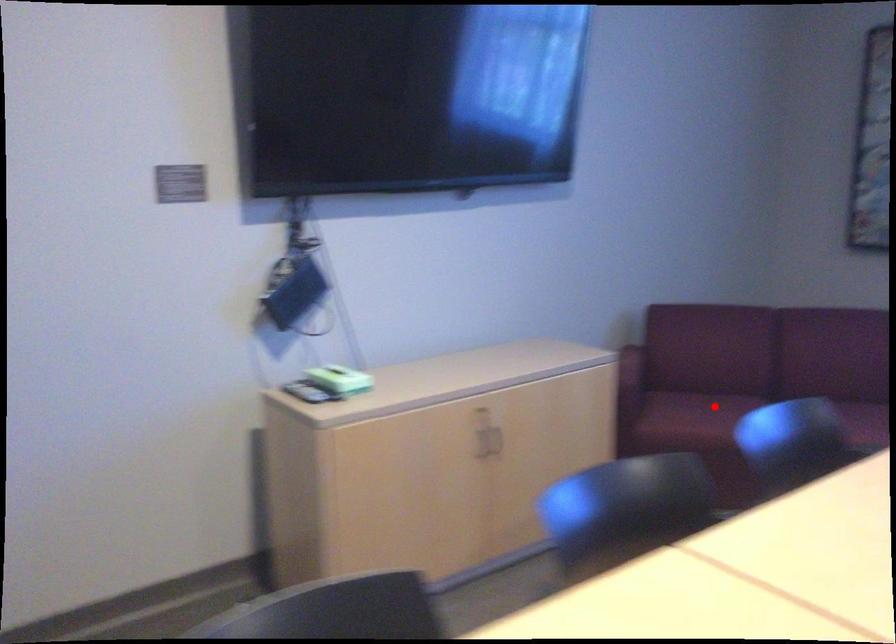
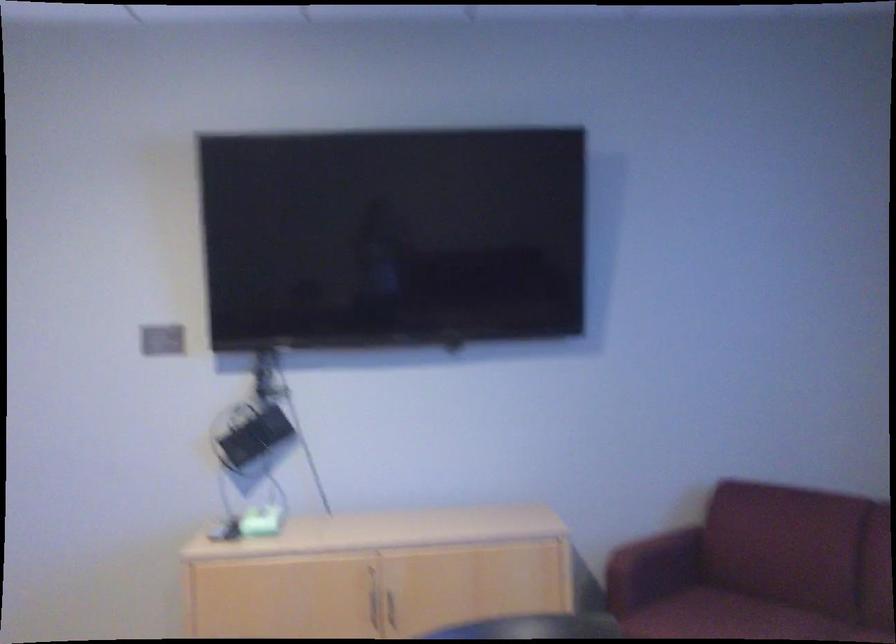
The point at the highlighted location is marked in the first image. Where is the corresponding point in the second image?

(722, 616)